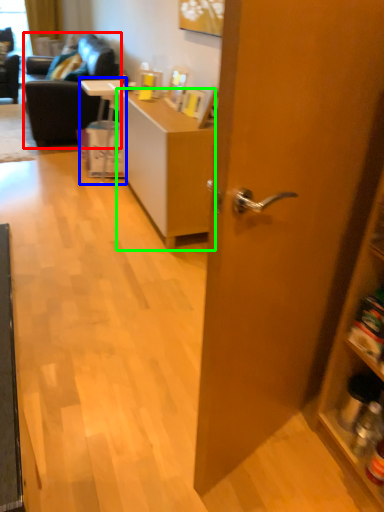
Question: Which object is positioned farthest from studio couch (highlighted by a red box)? Select from table (highlighted by a blue box) and desk (highlighted by a green box).

Choices:
 (A) table
 (B) desk

Answer: (B)